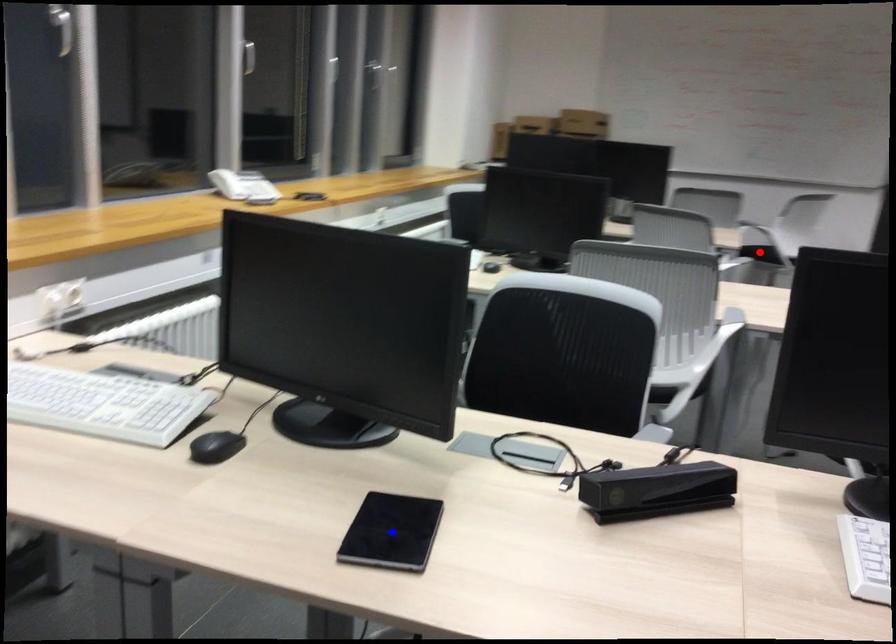
Question: Two points are marked on the image. Which point is closer to the camera?

Choices:
 (A) Blue point is closer.
 (B) Red point is closer.

Answer: (A)